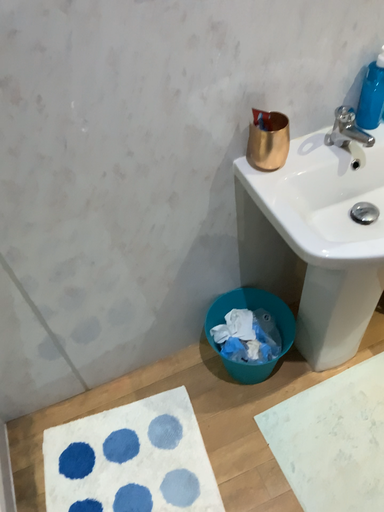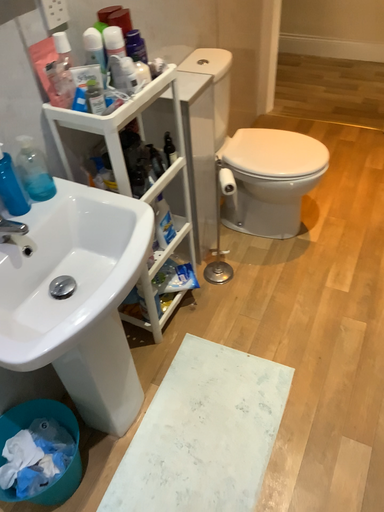
Question: Which way did the camera rotate in the video?

Choices:
 (A) rotated left
 (B) rotated right

Answer: (B)